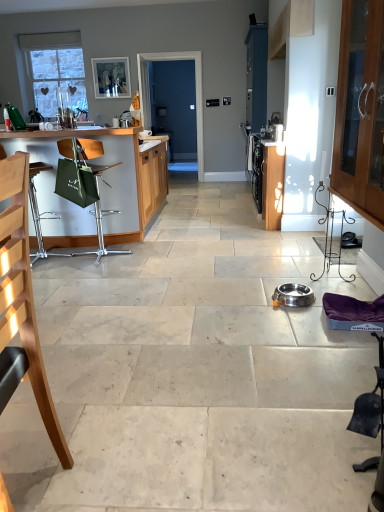
Question: Is wooden cabinet with glass doors at right at the right side of matte white picture frame at upper center?

Choices:
 (A) no
 (B) yes

Answer: (B)

Question: Would you consider wooden cabinet with glass doors at right to be distant from matte white picture frame at upper center?

Choices:
 (A) no
 (B) yes

Answer: (B)

Question: Is wooden cabinet with glass doors at right shorter than matte white picture frame at upper center?

Choices:
 (A) yes
 (B) no

Answer: (B)

Question: Is wooden cabinet with glass doors at right facing away from matte white picture frame at upper center?

Choices:
 (A) no
 (B) yes

Answer: (A)

Question: Is wooden cabinet with glass doors at right taller than matte white picture frame at upper center?

Choices:
 (A) no
 (B) yes

Answer: (B)

Question: Does wooden cabinet with glass doors at right lie behind matte white picture frame at upper center?

Choices:
 (A) yes
 (B) no

Answer: (B)

Question: Would you consider metallic green bag at left to be distant from metallic silver bowl at center?

Choices:
 (A) yes
 (B) no

Answer: (A)

Question: Would you say metallic silver bowl at center is part of metallic green bag at left's contents?

Choices:
 (A) no
 (B) yes

Answer: (A)

Question: Could you tell me if metallic green bag at left is turned towards metallic silver bowl at center?

Choices:
 (A) yes
 (B) no

Answer: (B)

Question: Does metallic green bag at left appear on the left side of metallic silver bowl at center?

Choices:
 (A) yes
 (B) no

Answer: (A)

Question: Can you confirm if metallic green bag at left is shorter than metallic silver bowl at center?

Choices:
 (A) yes
 (B) no

Answer: (B)

Question: From the image's perspective, is metallic green bag at left on top of metallic silver bowl at center?

Choices:
 (A) yes
 (B) no

Answer: (A)

Question: From the image's perspective, is stainless steel bowl at center on top of blue glossy screen door at center?

Choices:
 (A) no
 (B) yes

Answer: (A)